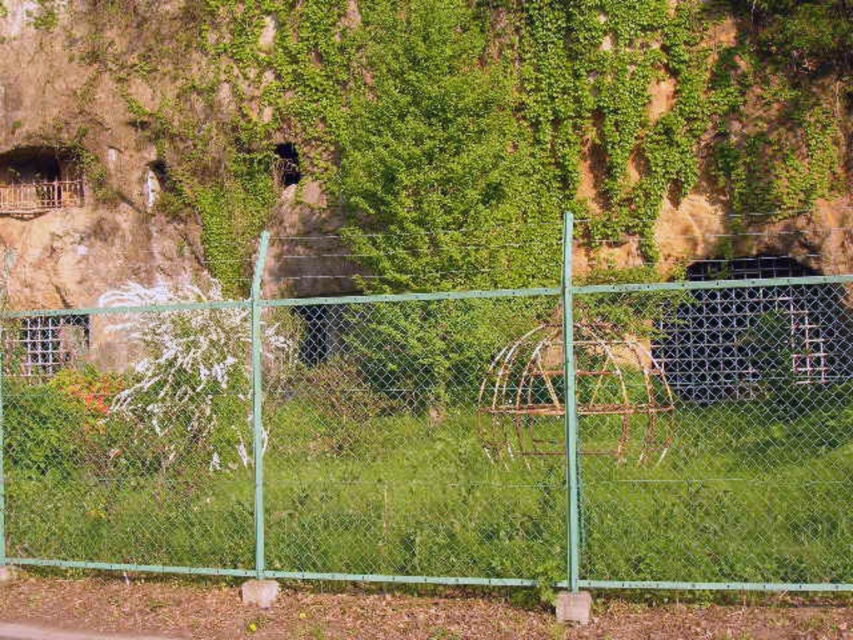
Question: Is green chain-link fence at center positioned in front of green ivy-covered cliff at upper center?

Choices:
 (A) no
 (B) yes

Answer: (B)

Question: Can you confirm if green chain-link fence at center is positioned above green ivy-covered cliff at upper center?

Choices:
 (A) yes
 (B) no

Answer: (B)

Question: Does green chain-link fence at center appear under green ivy-covered cliff at upper center?

Choices:
 (A) no
 (B) yes

Answer: (B)